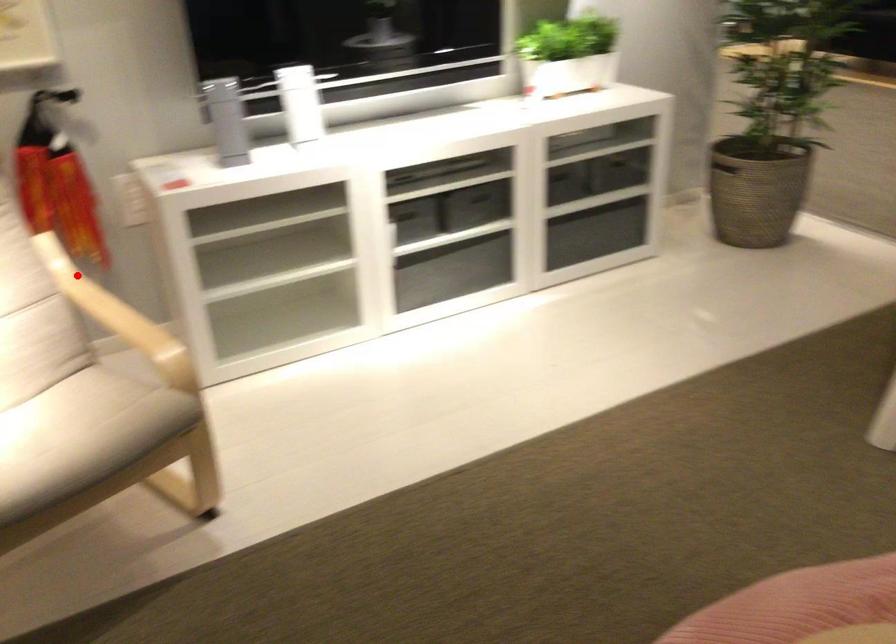
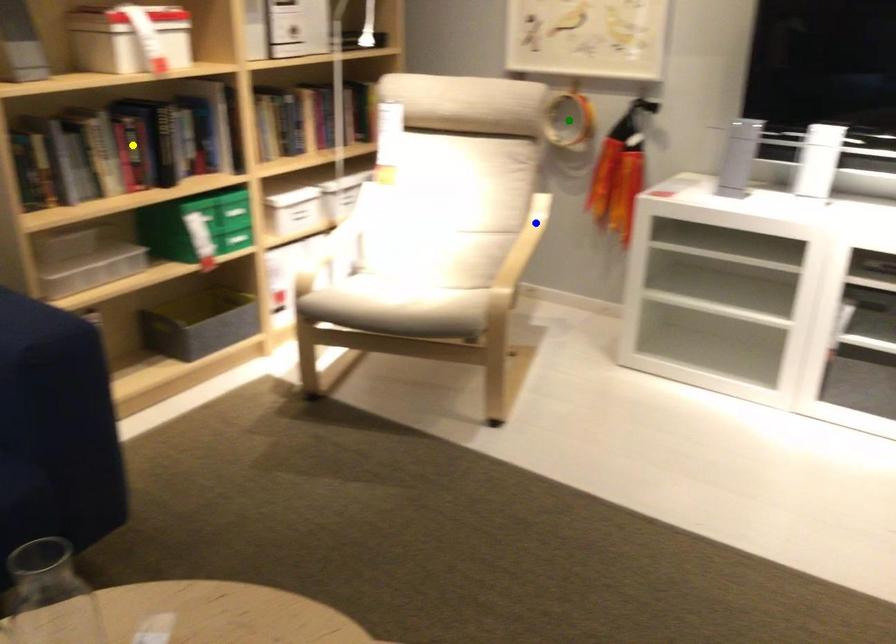
Question: I am providing you with two images of the same scene from different viewpoints. A red point is marked on the first image. You are given multiple points on the second image. Which spot in image 2 lines up with the point in image 1?

Choices:
 (A) blue point
 (B) yellow point
 (C) green point

Answer: (A)